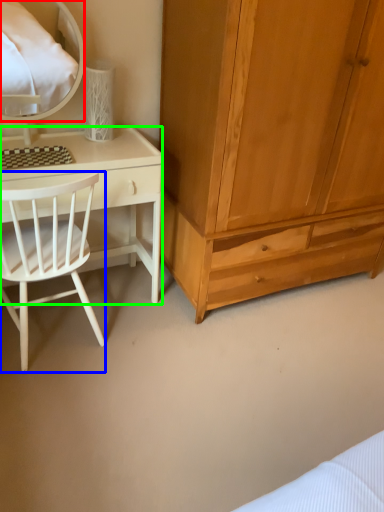
Question: Considering the real-world distances, which object is closest to mirror (highlighted by a red box)? chair (highlighted by a blue box) or desk (highlighted by a green box).

Choices:
 (A) chair
 (B) desk

Answer: (B)